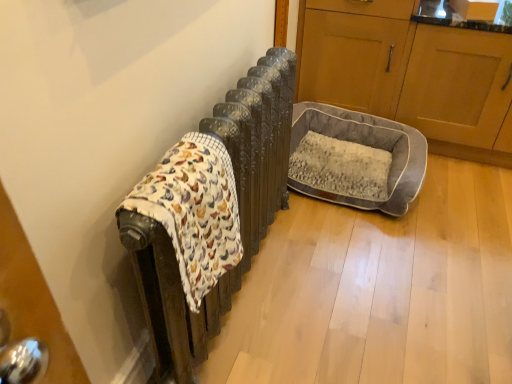
Locate an element on the screen. empty space that is to the right of gray plush dog bed at center is located at coordinates click(x=463, y=192).